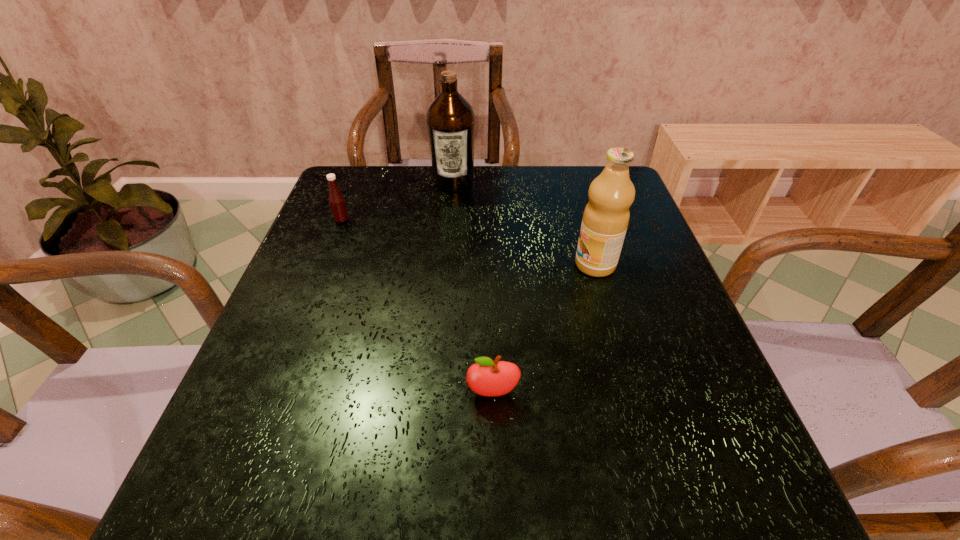
In order to click on free space located 0.050m on the label of the nearer olive oil in this screenshot , I will do `click(552, 265)`.

The width and height of the screenshot is (960, 540). What are the coordinates of `vacant area situated 0.090m on the label of the nearer olive oil` in the screenshot? It's located at (535, 265).

At what (x,y) coordinates should I click in order to perform the action: click on vacant area located on the right of the leftmost object. Please return your answer as a coordinate pair (x, y). The width and height of the screenshot is (960, 540). Looking at the image, I should click on (505, 220).

The height and width of the screenshot is (540, 960). I want to click on vacant space situated 0.180m on the right of the nearest object, so click(x=626, y=393).

At what (x,y) coordinates should I click in order to perform the action: click on object that is at the far edge. Please return your answer as a coordinate pair (x, y). The image size is (960, 540). Looking at the image, I should click on (450, 120).

Find the location of a particular element. object at the left edge is located at coordinates (337, 202).

Identify the location of object at the right edge. (606, 216).

You are a GUI agent. You are given a task and a screenshot of the screen. Output one action in this format:
    pyautogui.click(x=<x>, y=<y>)
    Task: Click on the vacant area at the far edge of the desktop
    Image resolution: width=960 pixels, height=540 pixels.
    Given the screenshot: What is the action you would take?
    pyautogui.click(x=482, y=167)

In the image, there is a desktop. Identify the location of vacant space at the near edge. (554, 466).

The height and width of the screenshot is (540, 960). In order to click on blank space at the left edge in this screenshot , I will do `click(230, 410)`.